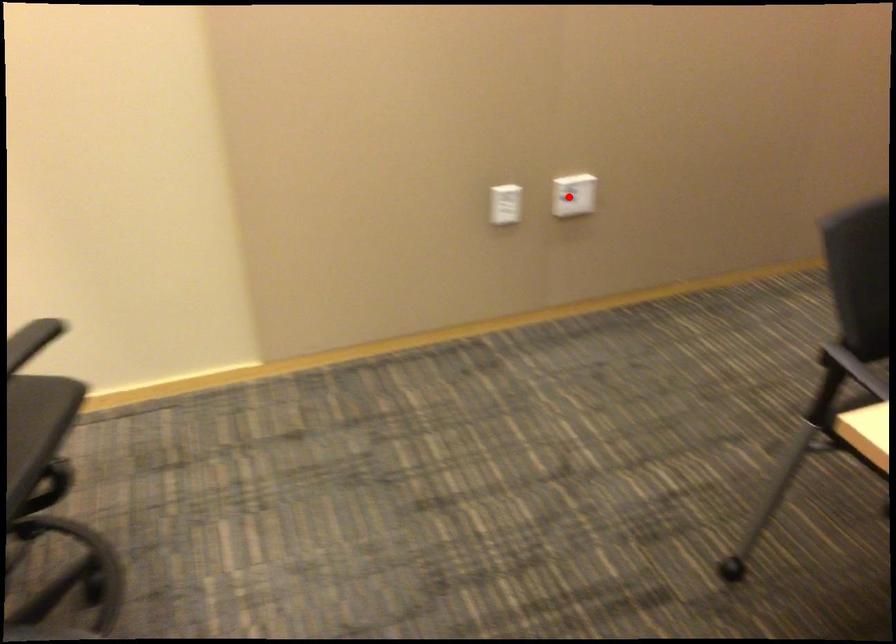
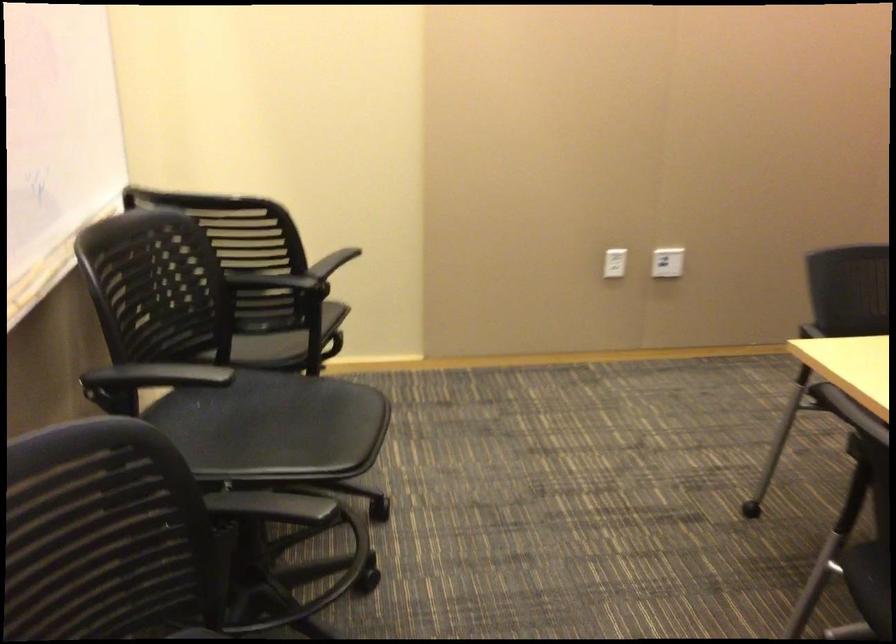
The point at the highlighted location is marked in the first image. Where is the corresponding point in the second image?

(667, 261)